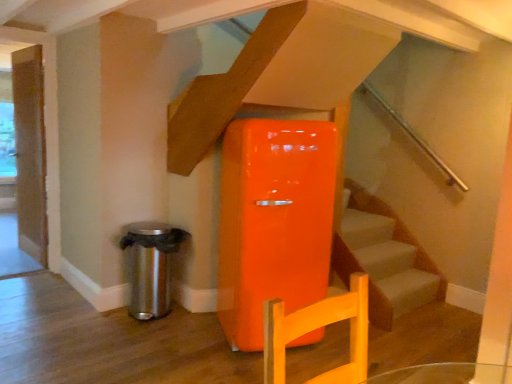
What is the approximate height of polished stainless steel trash can at lower left?

polished stainless steel trash can at lower left is 25.83 inches in height.

What do you see at coordinates (151, 266) in the screenshot? I see `polished stainless steel trash can at lower left` at bounding box center [151, 266].

Locate an element on the screen. The image size is (512, 384). polished stainless steel trash can at lower left is located at coordinates (151, 266).

Where is `wooden door at left`? The height and width of the screenshot is (384, 512). wooden door at left is located at coordinates (30, 151).

What is the approximate width of wooden door at left?

The width of wooden door at left is 2.93 inches.

The image size is (512, 384). What do you see at coordinates (30, 151) in the screenshot?
I see `wooden door at left` at bounding box center [30, 151].

You are a GUI agent. You are given a task and a screenshot of the screen. Output one action in this format:
    pyautogui.click(x=<x>, y=<y>)
    Task: Click on the polished stainless steel trash can at lower left
    
    Given the screenshot: What is the action you would take?
    coord(151,266)

Between wooden door at left and polished stainless steel trash can at lower left, which one appears on the right side from the viewer's perspective?

polished stainless steel trash can at lower left.

Which is behind, wooden door at left or polished stainless steel trash can at lower left?

wooden door at left.

Which point is more distant from viewer, [30,86] or [138,244]?

Point [30,86]

From the image's perspective, between wooden door at left and polished stainless steel trash can at lower left, which one is located above?

wooden door at left appears higher in the image.

From a real-world perspective, is wooden door at left above or below polished stainless steel trash can at lower left?

Clearly, from a real-world perspective, wooden door at left is above polished stainless steel trash can at lower left.

Considering the sizes of objects wooden door at left and polished stainless steel trash can at lower left in the image provided, who is wider, wooden door at left or polished stainless steel trash can at lower left?

Wider between the two is polished stainless steel trash can at lower left.

Can you confirm if wooden door at left is taller than polished stainless steel trash can at lower left?

Yes.

Which of these two, wooden door at left or polished stainless steel trash can at lower left, is smaller?

With smaller size is wooden door at left.

Is wooden door at left not inside polished stainless steel trash can at lower left?

Absolutely, wooden door at left is external to polished stainless steel trash can at lower left.

Is wooden door at left in contact with polished stainless steel trash can at lower left?

No.

Consider the image. Is wooden door at left positioned with its back to polished stainless steel trash can at lower left?

No.

This screenshot has height=384, width=512. I want to click on door above the polished stainless steel trash can at lower left (from a real-world perspective), so click(30, 151).

Between polished stainless steel trash can at lower left and wooden door at left, which one appears on the left side from the viewer's perspective?

Positioned to the left is wooden door at left.

Which object is closer to the camera, polished stainless steel trash can at lower left or wooden door at left?

polished stainless steel trash can at lower left is more forward.

Which is less distant, (169, 229) or (22, 65)?

Point (169, 229) appears to be closer to the viewer than point (22, 65).

From the image's perspective, between polished stainless steel trash can at lower left and wooden door at left, who is located below?

polished stainless steel trash can at lower left is shown below in the image.

From a real-world perspective, is polished stainless steel trash can at lower left below wooden door at left?

Indeed, from a real-world perspective, polished stainless steel trash can at lower left is positioned beneath wooden door at left.

Between polished stainless steel trash can at lower left and wooden door at left, which one has larger width?

polished stainless steel trash can at lower left.

Between polished stainless steel trash can at lower left and wooden door at left, which one has less height?

Standing shorter between the two is polished stainless steel trash can at lower left.

Is polished stainless steel trash can at lower left bigger than wooden door at left?

Correct, polished stainless steel trash can at lower left is larger in size than wooden door at left.

Is polished stainless steel trash can at lower left not within wooden door at left?

That's correct, polished stainless steel trash can at lower left is outside of wooden door at left.

Are polished stainless steel trash can at lower left and wooden door at left located far from each other?

Indeed, polished stainless steel trash can at lower left is not near wooden door at left.

Does polished stainless steel trash can at lower left turn towards wooden door at left?

No, polished stainless steel trash can at lower left is not aimed at wooden door at left.

Can you tell me how much polished stainless steel trash can at lower left and wooden door at left differ in facing direction?

polished stainless steel trash can at lower left and wooden door at left are facing 87.8 degrees away from each other.

Where is `door located above the polished stainless steel trash can at lower left (from a real-world perspective)`? The image size is (512, 384). door located above the polished stainless steel trash can at lower left (from a real-world perspective) is located at coordinates (30, 151).

In order to click on water heater on the right side of wooden door at left in this screenshot , I will do `click(151, 266)`.

Where is `door positioned vertically above the polished stainless steel trash can at lower left (from a real-world perspective)`? This screenshot has height=384, width=512. door positioned vertically above the polished stainless steel trash can at lower left (from a real-world perspective) is located at coordinates click(x=30, y=151).